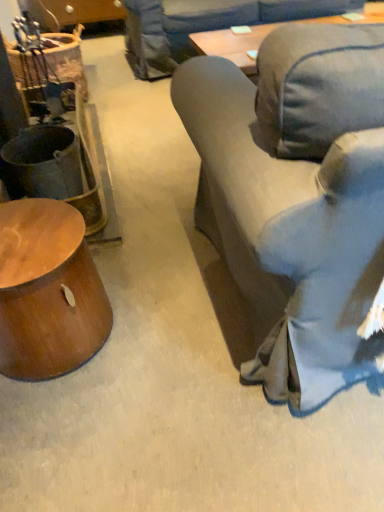
This screenshot has width=384, height=512. Identify the location of vacant area that is situated to the right of shiny brown wood side table at lower left. pyautogui.click(x=161, y=325).